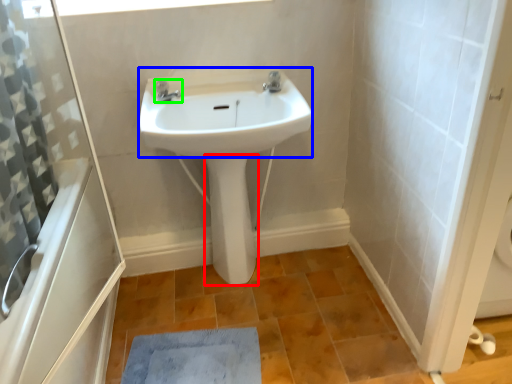
Question: Which object is the farthest from bidet (highlighted by a red box)? Choose among these: sink (highlighted by a blue box) or tap (highlighted by a green box).

Choices:
 (A) sink
 (B) tap

Answer: (B)